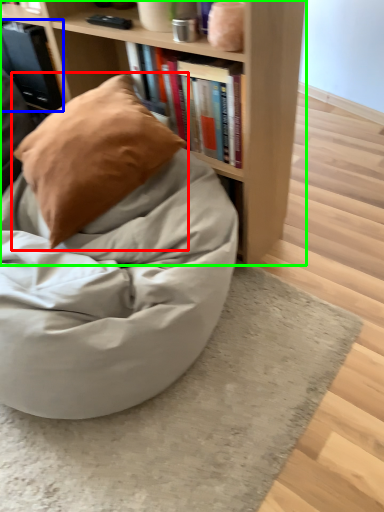
Question: Which object is positioned farthest from pillow (highlighted by a red box)? Select from book (highlighted by a blue box) and bookcase (highlighted by a green box).

Choices:
 (A) book
 (B) bookcase

Answer: (A)